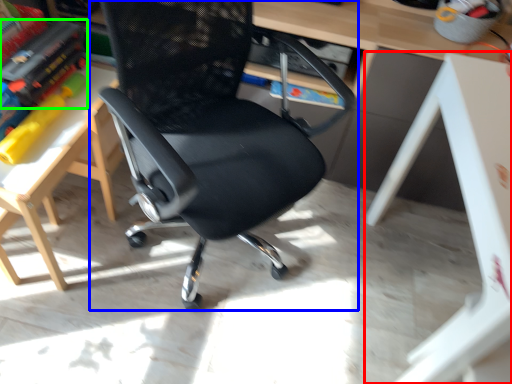
Question: Which is farther away from table (highlighted by a red box)? chair (highlighted by a blue box) or book (highlighted by a green box)?

Choices:
 (A) chair
 (B) book

Answer: (B)